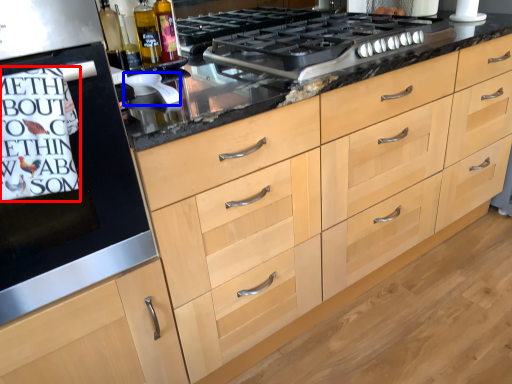
Question: Which point is closer to the camera, writing (highlighted by a red box) or appliance (highlighted by a blue box)?

Choices:
 (A) writing
 (B) appliance

Answer: (A)